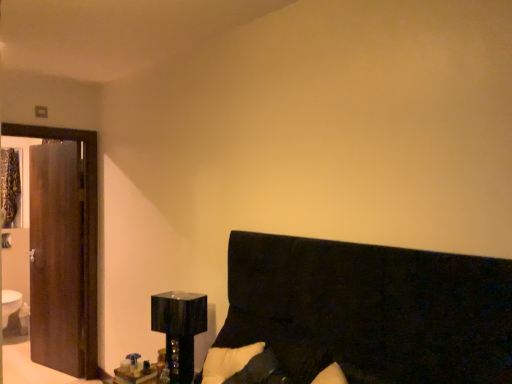
The height and width of the screenshot is (384, 512). In order to click on free space above wooden glossy table at lower left (from a real-world perspective) in this screenshot , I will do `click(138, 370)`.